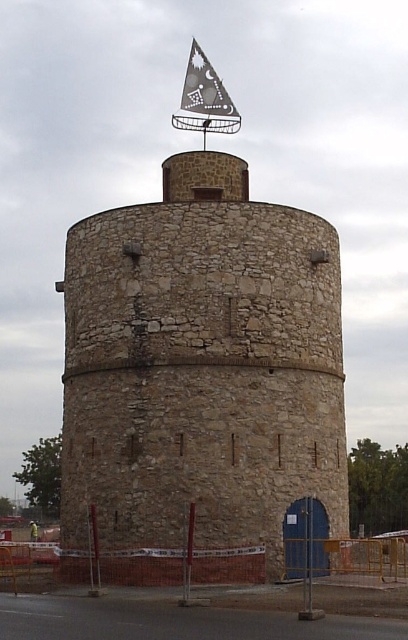
Question: Can you confirm if stone tower at center is wider than gray fabric flag at top?

Choices:
 (A) no
 (B) yes

Answer: (B)

Question: Which point is farther to the camera?

Choices:
 (A) stone tower at center
 (B) gray fabric flag at top

Answer: (B)

Question: Among these points, which one is nearest to the camera?

Choices:
 (A) 193,90
 (B) 257,211

Answer: (B)

Question: Is the position of stone tower at center more distant than that of gray fabric flag at top?

Choices:
 (A) yes
 (B) no

Answer: (B)

Question: Is stone tower at center further to camera compared to gray fabric flag at top?

Choices:
 (A) yes
 (B) no

Answer: (B)